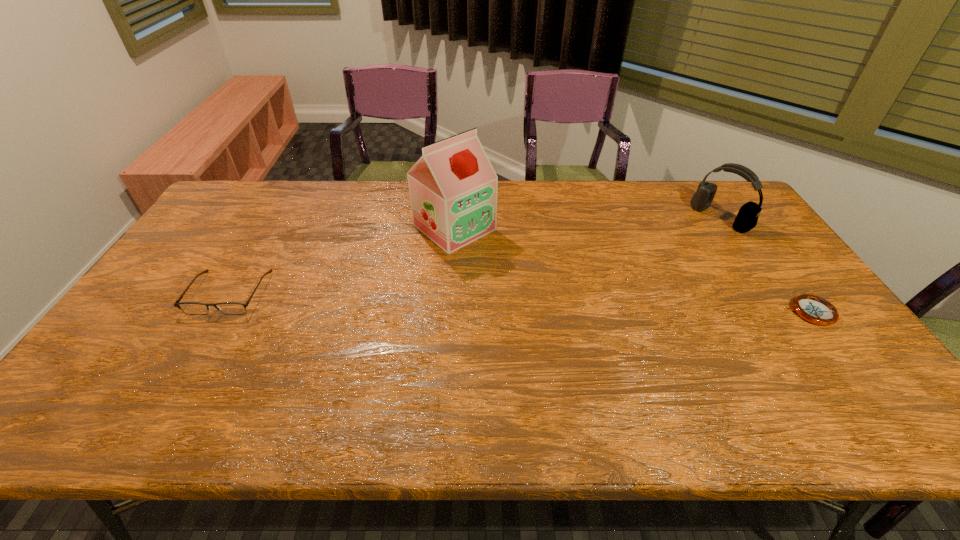
Image resolution: width=960 pixels, height=540 pixels. I want to click on vacant space on the desktop that is between the third tallest object and the shortest object and is positioned with the cap open on the third object from right to left, so click(x=556, y=303).

This screenshot has height=540, width=960. Find the location of `vacant spot on the desktop that is between the spectacles and the shortest object and is positioned on the headband of the headset`. vacant spot on the desktop that is between the spectacles and the shortest object and is positioned on the headband of the headset is located at coordinates (583, 305).